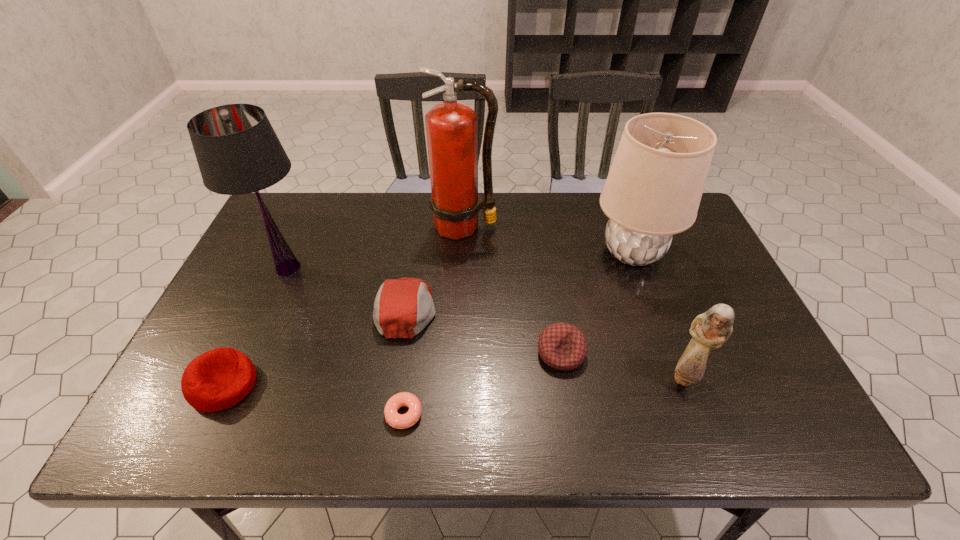
This screenshot has height=540, width=960. I want to click on beanbag at the near edge, so click(218, 379).

Image resolution: width=960 pixels, height=540 pixels. Find the location of `doughnut that is at the near edge`. doughnut that is at the near edge is located at coordinates click(399, 421).

Find the location of a particular element. This screenshot has height=540, width=960. lampshade that is at the left edge is located at coordinates (238, 152).

Identify the location of beanbag that is at the left edge. (218, 379).

Find the location of `object present at the right edge`. object present at the right edge is located at coordinates (653, 190).

Image resolution: width=960 pixels, height=540 pixels. I want to click on object that is at the near left corner, so [218, 379].

Identify the location of object present at the far right corner. The width and height of the screenshot is (960, 540). (653, 190).

You are a GUI agent. You are given a task and a screenshot of the screen. Output one action in this format:
    pyautogui.click(x=<x>, y=<y>)
    Task: Click on the free region at the far edge of the desktop
    
    Given the screenshot: What is the action you would take?
    pyautogui.click(x=563, y=223)

Identify the location of vacant space at the near edge of the desktop. This screenshot has width=960, height=540. (457, 417).

In the image, there is a desktop. Where is `free space at the left edge`? The width and height of the screenshot is (960, 540). free space at the left edge is located at coordinates (276, 295).